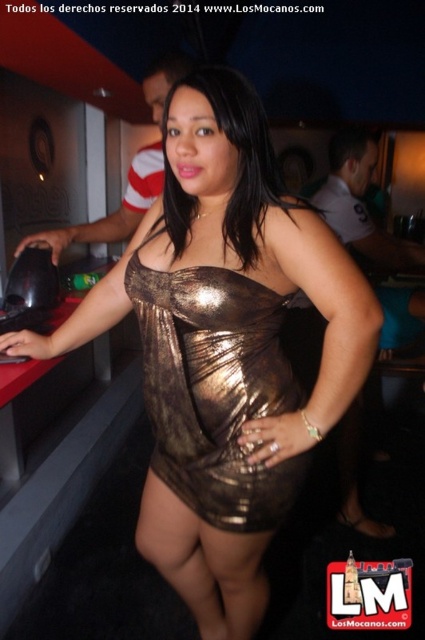
Describe the element at coordinates (215, 388) in the screenshot. The height and width of the screenshot is (640, 425). I see `shiny metallic dress at center` at that location.

Is shiny metallic dress at center further to camera compared to metallic gold dress at center?

That is False.

The height and width of the screenshot is (640, 425). In order to click on shiny metallic dress at center in this screenshot , I will do `click(215, 388)`.